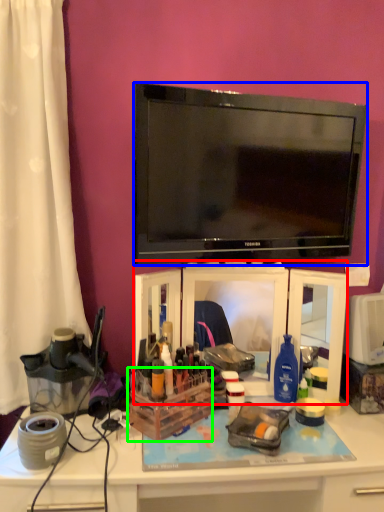
Question: Based on their relative distances, which object is farther from tv cabinet (highlighted by a red box)? Choose from television (highlighted by a blue box) and storage box (highlighted by a green box).

Choices:
 (A) television
 (B) storage box

Answer: (A)